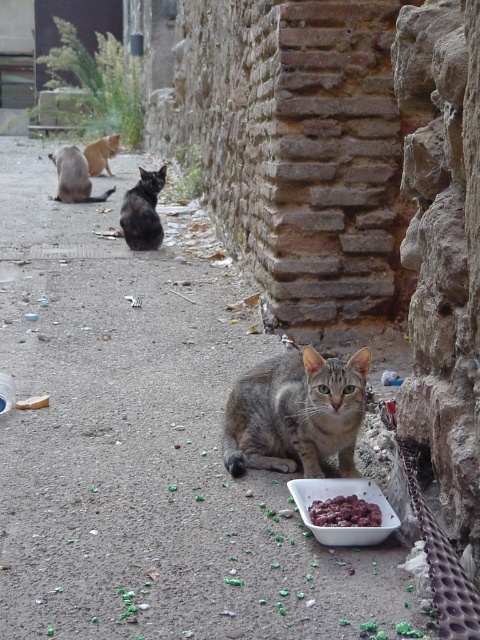
Question: Which point is farther to the camera?

Choices:
 (A) (2, 483)
 (B) (63, 189)

Answer: (B)

Question: Which point is farther to the camera?

Choices:
 (A) [373, 499]
 (B) [356, 515]

Answer: (A)

Question: Does striped fur cat at center have a lesser width compared to tabby fur cat at center?

Choices:
 (A) no
 (B) yes

Answer: (B)

Question: Is tabby fur cat at center below gray tabby cat at upper left?

Choices:
 (A) no
 (B) yes

Answer: (B)

Question: Is black fur cat at center further to the viewer compared to gray tabby cat at upper left?

Choices:
 (A) no
 (B) yes

Answer: (A)

Question: Which of the following is the farthest from the observer?

Choices:
 (A) striped fur cat at center
 (B) dark red meat at lower center

Answer: (B)